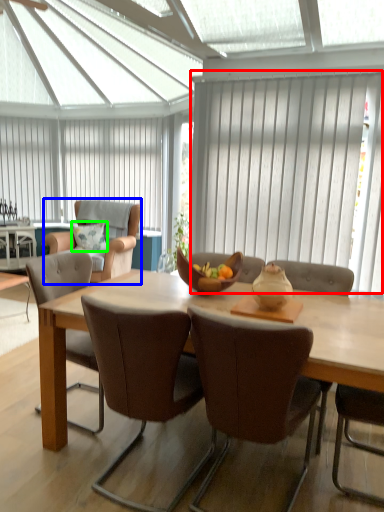
Question: Which object is positioned closest to curtain (highlighted by a red box)? Select from chair (highlighted by a blue box) and pillow (highlighted by a green box).

Choices:
 (A) chair
 (B) pillow

Answer: (A)